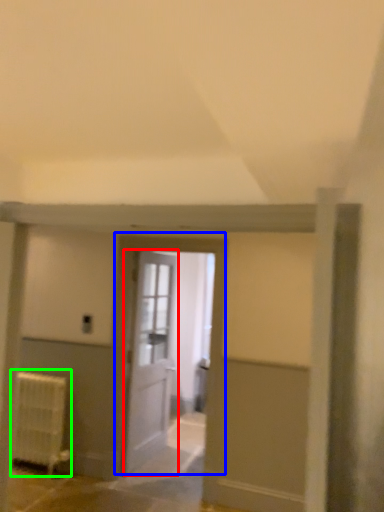
Question: Which is farther away from door (highlighted by a red box)? door (highlighted by a blue box) or radiator (highlighted by a green box)?

Choices:
 (A) door
 (B) radiator

Answer: (B)